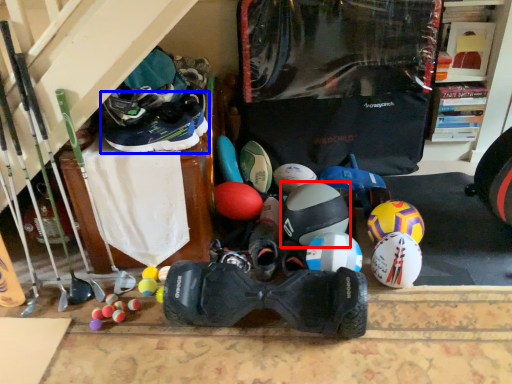
Question: Among these objects, which one is farthest to the camera, helmet (highlighted by a red box) or footwear (highlighted by a blue box)?

Choices:
 (A) helmet
 (B) footwear

Answer: (A)